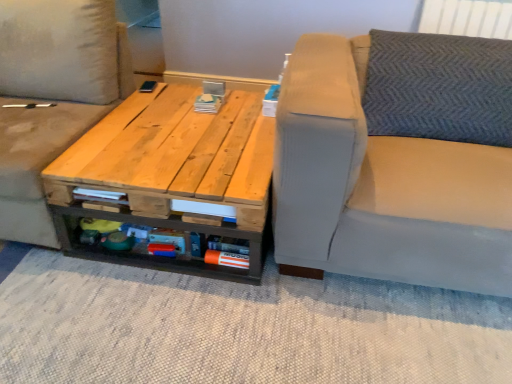
Question: Is light beige fabric studio couch at center, which appears as the 2th studio couch when viewed from the right, not within light beige fabric studio couch at right, which appears as the second studio couch when viewed from the left?

Choices:
 (A) no
 (B) yes

Answer: (B)

Question: From the image's perspective, does light beige fabric studio couch at center, which is counted as the first studio couch, starting from the left, appear higher than light beige fabric studio couch at right, arranged as the 1th studio couch when viewed from the right?

Choices:
 (A) no
 (B) yes

Answer: (B)

Question: Considering the relative sizes of light beige fabric studio couch at center, which appears as the 2th studio couch when viewed from the right, and light beige fabric studio couch at right, arranged as the 1th studio couch when viewed from the right, in the image provided, is light beige fabric studio couch at center, which appears as the 2th studio couch when viewed from the right, thinner than light beige fabric studio couch at right, arranged as the 1th studio couch when viewed from the right,?

Choices:
 (A) no
 (B) yes

Answer: (B)

Question: Considering the relative sizes of light beige fabric studio couch at center, which appears as the 2th studio couch when viewed from the right, and light beige fabric studio couch at right, which appears as the second studio couch when viewed from the left, in the image provided, is light beige fabric studio couch at center, which appears as the 2th studio couch when viewed from the right, taller than light beige fabric studio couch at right, which appears as the second studio couch when viewed from the left,?

Choices:
 (A) yes
 (B) no

Answer: (A)

Question: Considering the relative positions of light beige fabric studio couch at center, which is counted as the first studio couch, starting from the left, and light beige fabric studio couch at right, arranged as the 1th studio couch when viewed from the right, in the image provided, is light beige fabric studio couch at center, which is counted as the first studio couch, starting from the left, to the left of light beige fabric studio couch at right, arranged as the 1th studio couch when viewed from the right, from the viewer's perspective?

Choices:
 (A) yes
 (B) no

Answer: (A)

Question: From a real-world perspective, is natural wood table at center positioned above or below light beige fabric studio couch at center, which is counted as the first studio couch, starting from the left?

Choices:
 (A) below
 (B) above

Answer: (A)

Question: In terms of width, does natural wood table at center look wider or thinner when compared to light beige fabric studio couch at center, which is counted as the first studio couch, starting from the left?

Choices:
 (A) thin
 (B) wide

Answer: (B)

Question: Relative to light beige fabric studio couch at center, which is counted as the first studio couch, starting from the left, is natural wood table at center in front or behind?

Choices:
 (A) behind
 (B) front

Answer: (A)

Question: Considering the positions of natural wood table at center and light beige fabric studio couch at center, which appears as the 2th studio couch when viewed from the right, in the image, is natural wood table at center taller or shorter than light beige fabric studio couch at center, which appears as the 2th studio couch when viewed from the right,?

Choices:
 (A) short
 (B) tall

Answer: (A)

Question: From the image's perspective, is light beige fabric studio couch at right, arranged as the 1th studio couch when viewed from the right, located above or below natural wood table at center?

Choices:
 (A) above
 (B) below

Answer: (A)

Question: Is light beige fabric studio couch at right, arranged as the 1th studio couch when viewed from the right, wider or thinner than natural wood table at center?

Choices:
 (A) thin
 (B) wide

Answer: (B)

Question: Considering the positions of point (472, 152) and point (160, 145), is point (472, 152) closer or farther from the camera than point (160, 145)?

Choices:
 (A) closer
 (B) farther

Answer: (A)

Question: Visually, is light beige fabric studio couch at right, which appears as the second studio couch when viewed from the left, positioned to the left or to the right of natural wood table at center?

Choices:
 (A) left
 (B) right

Answer: (B)

Question: In the image, is light beige fabric studio couch at center, which is counted as the first studio couch, starting from the left, on the left side or the right side of light beige fabric studio couch at right, which appears as the second studio couch when viewed from the left?

Choices:
 (A) left
 (B) right

Answer: (A)

Question: From the image's perspective, is light beige fabric studio couch at center, which appears as the 2th studio couch when viewed from the right, positioned above or below light beige fabric studio couch at right, which appears as the second studio couch when viewed from the left?

Choices:
 (A) below
 (B) above

Answer: (B)